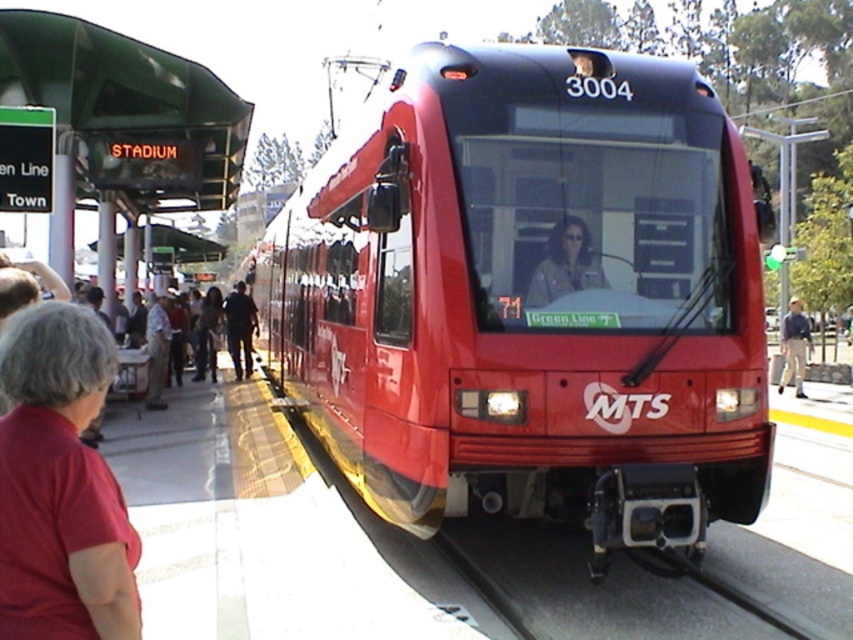
You are a passenger waiting on the platform and see the glossy red train at center and the red cotton shirt at lower left. Which object takes up more space in the image?

The red cotton shirt at lower left takes up more space in the image than the glossy red train at center because the glossy red train at center is smaller than red cotton shirt at lower left.

You are a passenger standing on the platform waiting for the train. You see the black rubber train track at lower center and the blue denim jeans at right. Which object is closer to your feet?

The black rubber train track at lower center is positioned under blue denim jeans at right, so the black rubber train track at lower center is closer to your feet.

You are standing on the platform and want to know which of the two points, point (782, 592) or point (793, 301), is closer to you. Based on the scene, which point is nearer?

Point (782, 592) is closer to the viewer than point (793, 301).